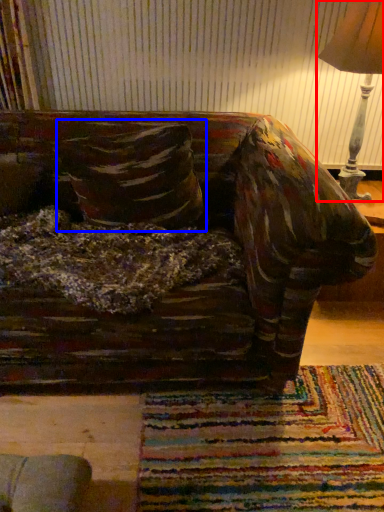
Question: Among these objects, which one is nearest to the camera, lamp (highlighted by a red box) or throw pillow (highlighted by a blue box)?

Choices:
 (A) lamp
 (B) throw pillow

Answer: (A)